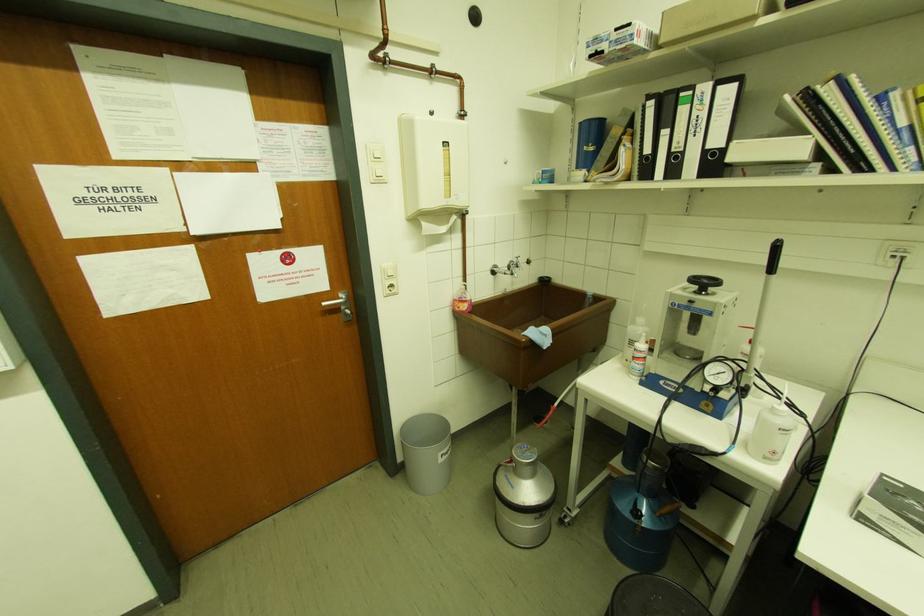
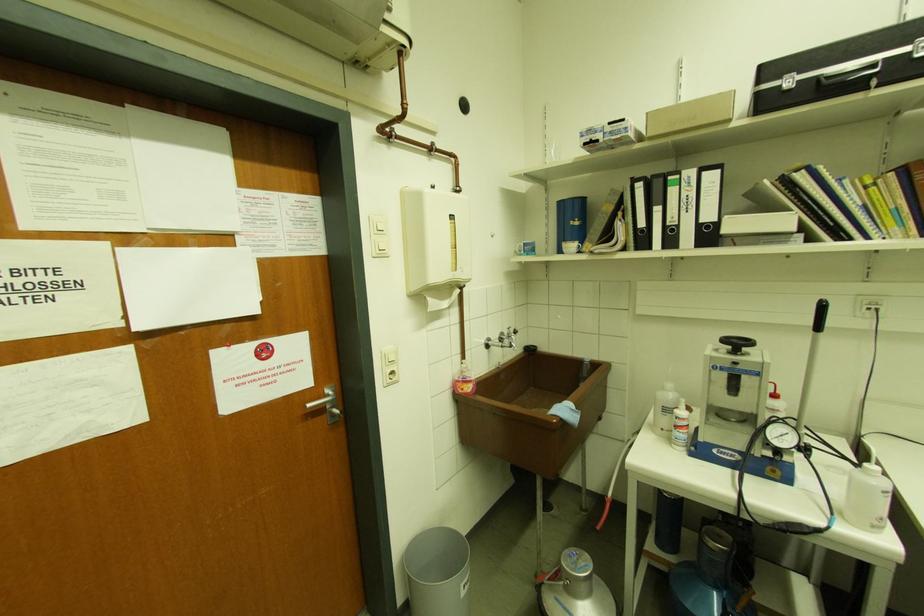
Find the pixel in the second image that matches the point at 772,460 in the first image.

(880, 530)